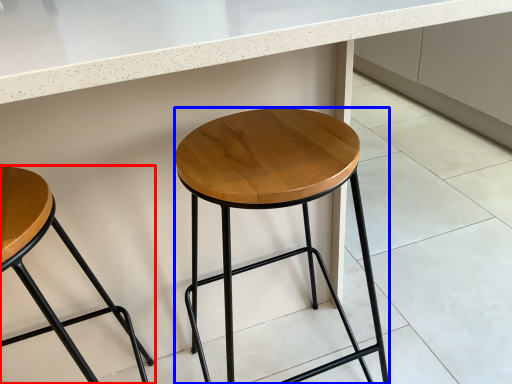
Question: Which point is further to the camera, stool (highlighted by a red box) or stool (highlighted by a blue box)?

Choices:
 (A) stool
 (B) stool

Answer: (B)